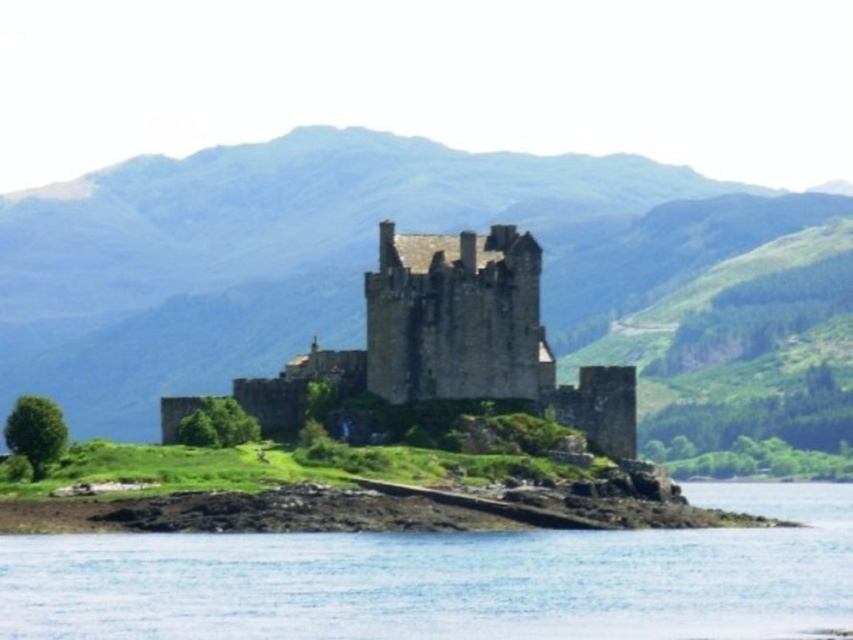
Question: Is clear blue water at lower center positioned in front of rocks at lower left?

Choices:
 (A) yes
 (B) no

Answer: (A)

Question: Which object is the closest to the clear blue water at lower center?

Choices:
 (A) brown stone castle at center
 (B) rocks at lower left

Answer: (B)

Question: Is brown stone castle at center below rocks at lower left?

Choices:
 (A) no
 (B) yes

Answer: (A)

Question: Considering the real-world distances, which object is closest to the rocks at lower left?

Choices:
 (A) clear blue water at lower center
 (B) brown stone castle at center

Answer: (A)

Question: Estimate the real-world distances between objects in this image. Which object is closer to the clear blue water at lower center?

Choices:
 (A) brown stone castle at center
 (B) rocks at lower left

Answer: (B)

Question: Is clear blue water at lower center to the left of rocks at lower left from the viewer's perspective?

Choices:
 (A) yes
 (B) no

Answer: (B)